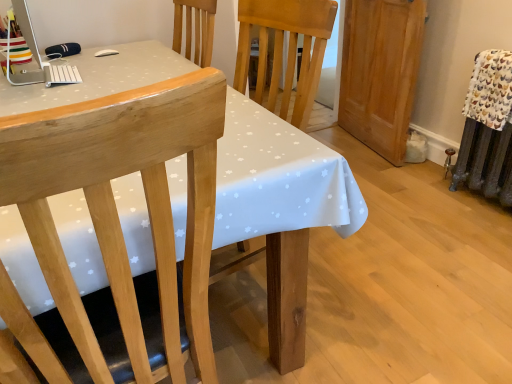
Where is `free location in front of light brown wood armoire at right`? Image resolution: width=512 pixels, height=384 pixels. free location in front of light brown wood armoire at right is located at coordinates (407, 183).